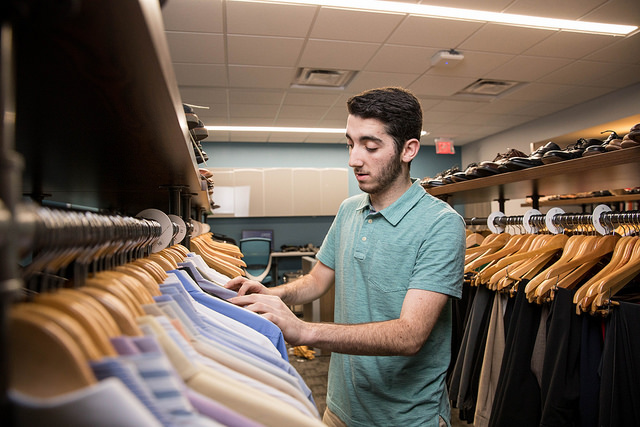
Where is `closet`? closet is located at coordinates (310, 139).